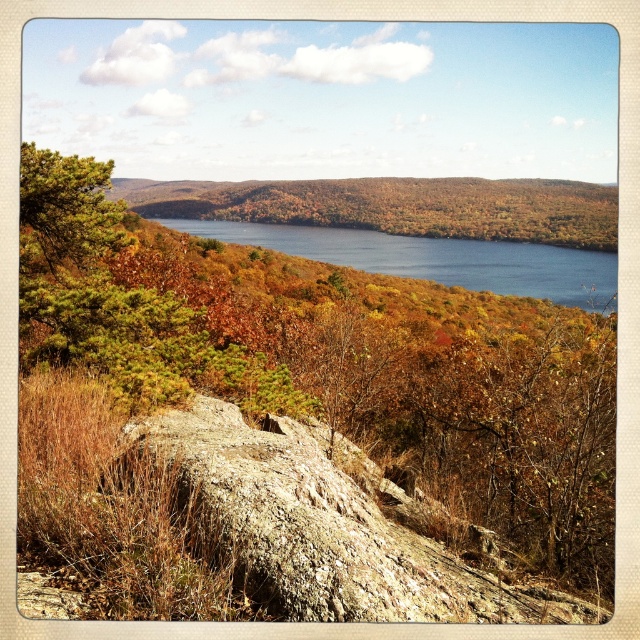
Question: Among these objects, which one is nearest to the camera?

Choices:
 (A) blue water at center
 (B) green matte pine tree at upper left
 (C) green leafy tree at center
 (D) autumn foliage at center

Answer: (C)

Question: Is green leafy tree at center further to camera compared to brown rough rock at center?

Choices:
 (A) no
 (B) yes

Answer: (B)

Question: Is brown rough rock at center smaller than blue water at center?

Choices:
 (A) yes
 (B) no

Answer: (A)

Question: Which point is closer to the camera?

Choices:
 (A) autumn foliage at center
 (B) blue water at center

Answer: (A)

Question: Which object appears farthest from the camera in this image?

Choices:
 (A) autumn foliage at center
 (B) brown rough rock at center

Answer: (A)

Question: Does autumn foliage at center appear on the right side of blue water at center?

Choices:
 (A) no
 (B) yes

Answer: (B)